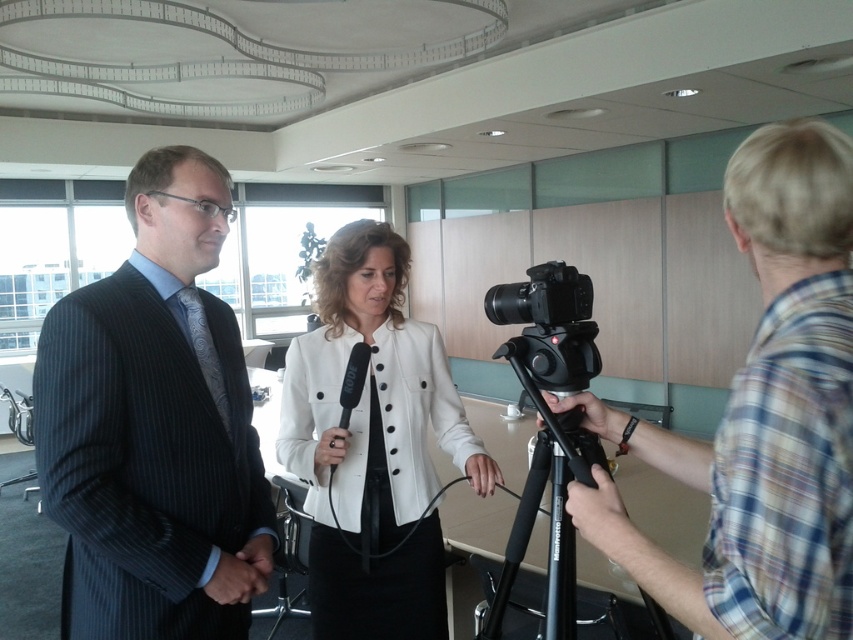
Is plaid shirt at right bigger than white matte jacket at center?

No.

At what (x,y) coordinates should I click in order to perform the action: click on plaid shirt at right. Please return your answer as a coordinate pair (x, y). This screenshot has width=853, height=640. Looking at the image, I should click on (761, 417).

Does point (846, 515) lie in front of point (428, 376)?

Yes.

Locate an element on the screen. The width and height of the screenshot is (853, 640). plaid shirt at right is located at coordinates (761, 417).

Is point (238, 337) farther from viewer compared to point (548, 420)?

Yes, it is.

Between dark pinstripe suit at left and black rubber tripod at lower right, which one appears on the right side from the viewer's perspective?

From the viewer's perspective, black rubber tripod at lower right appears more on the right side.

The image size is (853, 640). In order to click on dark pinstripe suit at left in this screenshot , I will do `click(154, 426)`.

Between white matte jacket at center and black plastic camera at center, which one has less height?

With less height is black plastic camera at center.

Can you confirm if white matte jacket at center is wider than black plastic camera at center?

Yes.

Identify the location of white matte jacket at center. (373, 444).

The image size is (853, 640). Find the location of `white matte jacket at center`. white matte jacket at center is located at coordinates point(373,444).